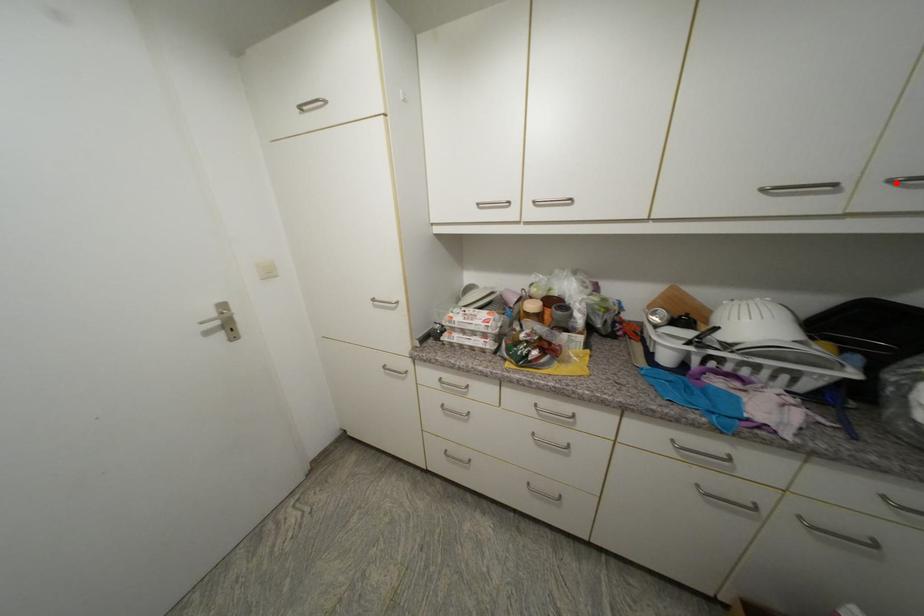
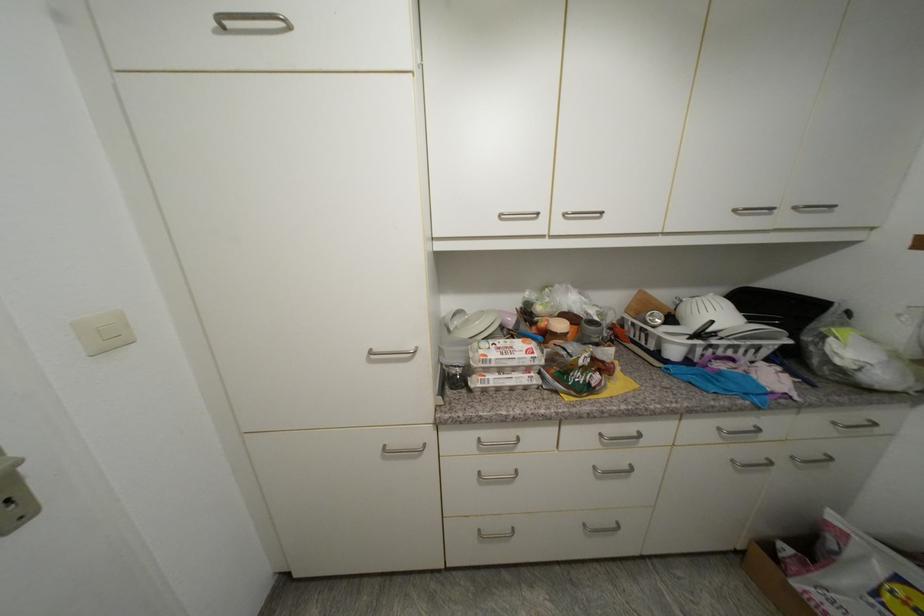
In the second image, find the point that corresponds to the highlighted location in the first image.

(800, 209)